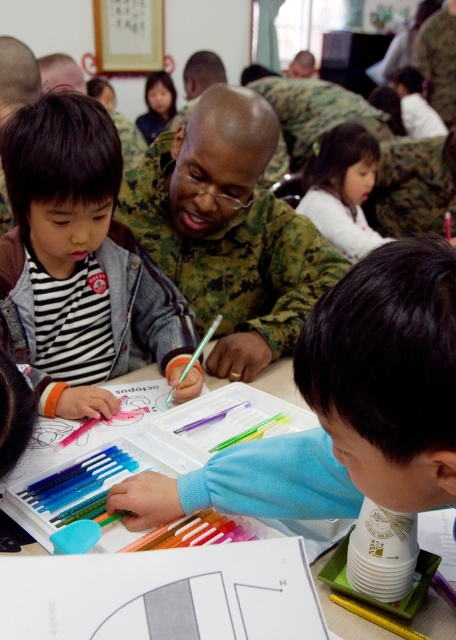
You are a teacher organizing an art activity in the classroom. You need to place a new set of crayons on the table. Can you confirm if there is enough space on the white plastic table at center for the camouflage uniform at center and the crayons?

The camouflage uniform at center is positioned over white plastic table at center, which means the table has space for both the uniform and the crayons since the uniform is on the table.

You are a teacher in a classroom and need to place a 15 inch wide box between the smooth blue sweater at lower right and the white plastic table at center. Can you fit it there?

The distance between the smooth blue sweater at lower right and the white plastic table at center is 17.11 inches. Since the box is 15 inches wide, it can fit in the space between them.

You are organizing a clothing donation drive and need to sort items by size. You have a smooth blue sweater at lower right and a striped fabric shirt at center. Which item should you place in the small size bin?

The smooth blue sweater at lower right has a smaller size compared to the striped fabric shirt at center, so it should be placed in the small size bin.